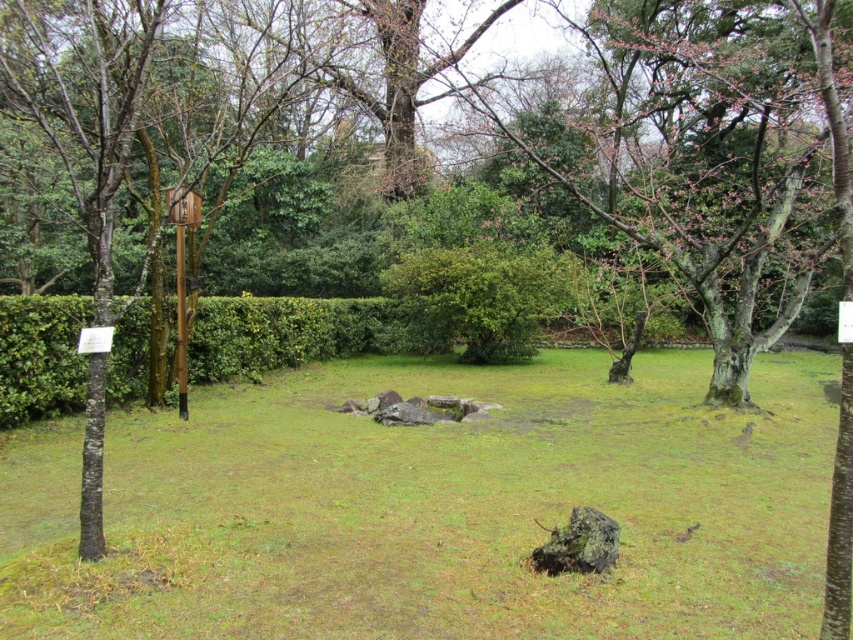
You are designing a garden layout and need to know the spatial relationship between the green grass at center and the green leafy hedge at center. Which one is wider?

The green grass at center is wider than the green leafy hedge at center.

You are a gardener who wants to plant a new flower in the garden. You see the green grass at center and the green leafy bush at center. Which object is located below the other?

The green grass at center is positioned under the green leafy bush at center, so the grass is below the bush.